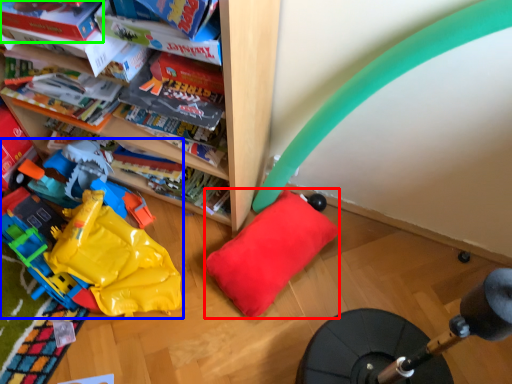
Question: Which object is positioned farthest from pillow (highlighted by a red box)? Select from toy (highlighted by a blue box) and book (highlighted by a green box).

Choices:
 (A) toy
 (B) book

Answer: (B)